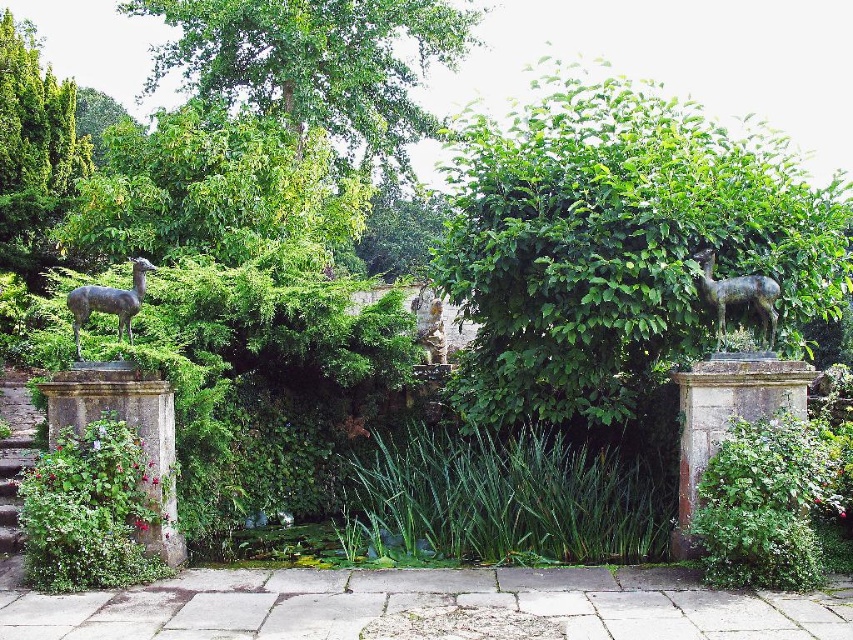
Question: Which object appears closest to the camera in this image?

Choices:
 (A) shiny bronze deer at right
 (B) green leafy bush at center
 (C) green leafy tree at upper center

Answer: (A)

Question: Can you confirm if green leafy tree at upper center is positioned to the left of satin gold statue at center?

Choices:
 (A) yes
 (B) no

Answer: (A)

Question: Which of these objects is positioned closest to the satin gold statue at center?

Choices:
 (A) shiny bronze deer at right
 (B) bronze statue at left
 (C) green leafy tree at upper center

Answer: (C)

Question: Among these objects, which one is farthest from the camera?

Choices:
 (A) green leafy bush at center
 (B) bronze statue at left

Answer: (A)

Question: Does green leafy tree at upper center have a smaller size compared to bronze statue at left?

Choices:
 (A) no
 (B) yes

Answer: (A)

Question: In this image, where is green leafy bush at center located relative to satin gold statue at center?

Choices:
 (A) above
 (B) below

Answer: (A)